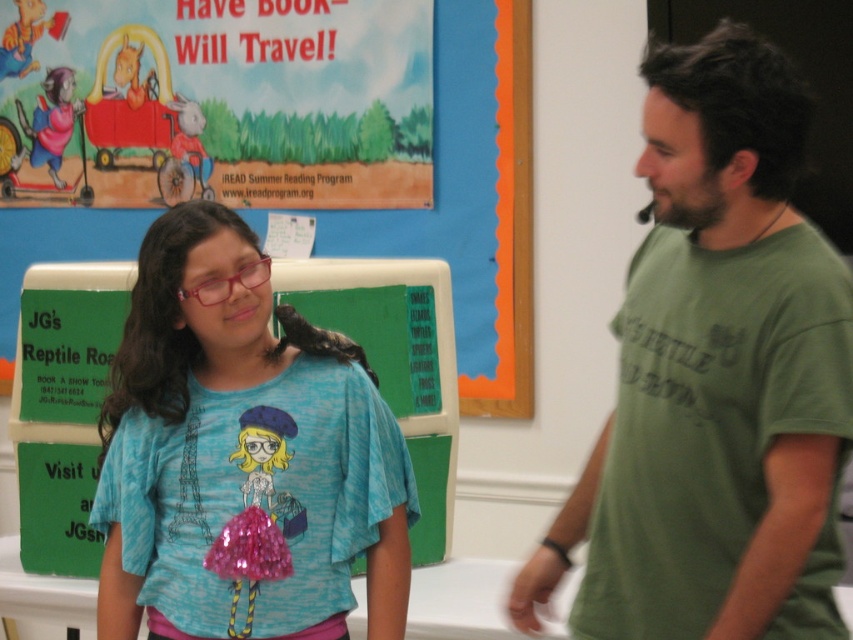
Between blue fabric shirt at center and matte paper poster at upper left, which one has less height?

blue fabric shirt at center is shorter.

Is blue fabric shirt at center to the left of matte paper poster at upper left from the viewer's perspective?

No, blue fabric shirt at center is not to the left of matte paper poster at upper left.

What do you see at coordinates (241, 449) in the screenshot? I see `blue fabric shirt at center` at bounding box center [241, 449].

I want to click on blue fabric shirt at center, so click(x=241, y=449).

Can you confirm if green cotton t-shirt at right is positioned to the left of matte paper poster at upper left?

No, green cotton t-shirt at right is not to the left of matte paper poster at upper left.

Is green cotton t-shirt at right taller than matte paper poster at upper left?

Indeed, green cotton t-shirt at right has a greater height compared to matte paper poster at upper left.

The width and height of the screenshot is (853, 640). What do you see at coordinates (715, 378) in the screenshot?
I see `green cotton t-shirt at right` at bounding box center [715, 378].

Find the location of a particular element. Image resolution: width=853 pixels, height=640 pixels. green cotton t-shirt at right is located at coordinates (715, 378).

Measure the distance between green cotton t-shirt at right and blue fabric shirt at center.

A distance of 21.54 inches exists between green cotton t-shirt at right and blue fabric shirt at center.

Looking at this image, is green cotton t-shirt at right shorter than blue fabric shirt at center?

Incorrect, green cotton t-shirt at right's height does not fall short of blue fabric shirt at center's.

What are the coordinates of `green cotton t-shirt at right` in the screenshot? It's located at (715, 378).